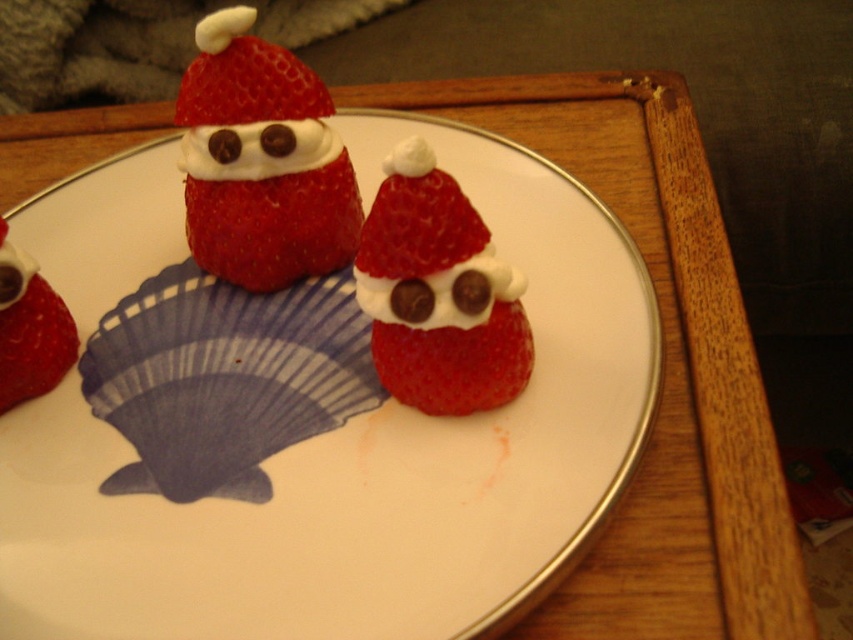
Is smooth white plate at center thinner than white soft blanket at upper left?

In fact, smooth white plate at center might be wider than white soft blanket at upper left.

Where is `smooth white plate at center`? This screenshot has height=640, width=853. smooth white plate at center is located at coordinates (363, 461).

You are a GUI agent. You are given a task and a screenshot of the screen. Output one action in this format:
    pyautogui.click(x=<x>, y=<y>)
    Task: Click on the smooth white plate at center
    The height and width of the screenshot is (640, 853).
    Given the screenshot: What is the action you would take?
    pyautogui.click(x=363, y=461)

Is matte white cream at upper center shorter than white cream at center?

Incorrect, matte white cream at upper center's height does not fall short of white cream at center's.

Is matte white cream at upper center further to the viewer compared to white cream at center?

No, it is in front of white cream at center.

The height and width of the screenshot is (640, 853). I want to click on matte white cream at upper center, so click(x=260, y=161).

Locate an element on the screen. Image resolution: width=853 pixels, height=640 pixels. matte white cream at upper center is located at coordinates (260, 161).

Describe the element at coordinates (137, 44) in the screenshot. I see `white soft blanket at upper left` at that location.

Between white soft blanket at upper left and white cream frosting at center, which one appears on the right side from the viewer's perspective?

Positioned to the right is white cream frosting at center.

Where is `white soft blanket at upper left`? This screenshot has height=640, width=853. white soft blanket at upper left is located at coordinates (137, 44).